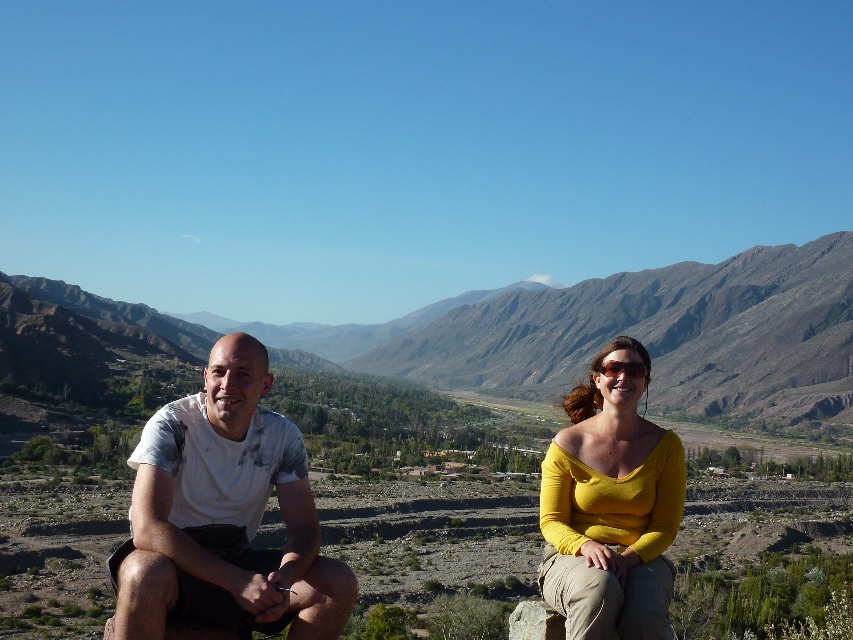
Is white cotton shirt at center smaller than sunglasses at center?

No, white cotton shirt at center is not smaller than sunglasses at center.

Is white cotton shirt at center bigger than sunglasses at center?

Yes, white cotton shirt at center is bigger than sunglasses at center.

Does point (579, 435) come farther from viewer compared to point (642, 374)?

No, (579, 435) is closer to viewer.

You are a GUI agent. You are given a task and a screenshot of the screen. Output one action in this format:
    pyautogui.click(x=<x>, y=<y>)
    Task: Click on the white cotton shirt at center
    This screenshot has width=853, height=640.
    Given the screenshot: What is the action you would take?
    pyautogui.click(x=616, y=502)

Which is above, white cotton t-shirt at left or white cotton shirt at center?

Positioned higher is white cotton shirt at center.

Who is taller, white cotton t-shirt at left or white cotton shirt at center?

white cotton shirt at center

Which is in front, point (184, 592) or point (279, 577)?

Positioned in front is point (184, 592).

Where is `white cotton t-shirt at left`? Image resolution: width=853 pixels, height=640 pixels. white cotton t-shirt at left is located at coordinates (224, 515).

Is brown rocky mountain at center to the left of matte yellow top at center from the viewer's perspective?

Correct, you'll find brown rocky mountain at center to the left of matte yellow top at center.

Between point (782, 332) and point (555, 452), which one is positioned behind?

The point (782, 332) is more distant.

Where is `brown rocky mountain at center`? The height and width of the screenshot is (640, 853). brown rocky mountain at center is located at coordinates (659, 333).